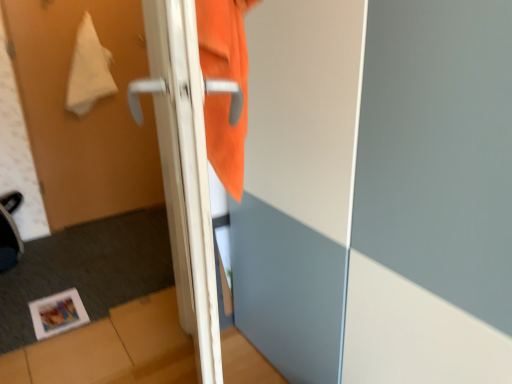
Question: Relative to matte paper photo frame at lower left, is white glossy door handle at left, the second screen door from the right, in front or behind?

Choices:
 (A) behind
 (B) front

Answer: (B)

Question: From the image's perspective, relative to matte paper photo frame at lower left, is white glossy door handle at left, the second screen door from the right, above or below?

Choices:
 (A) below
 (B) above

Answer: (B)

Question: Based on their relative distances, which object is nearer to the white fabric towel at upper left?

Choices:
 (A) white glossy door handle at center
 (B) orange fabric at center, arranged as the 1th screen door when viewed from the right
 (C) orange fabric sweatshirt at upper center
 (D) white matte towel at upper left, placed as the 3th screen door when sorted from right to left
 (E) white glossy door handle at left, the second screen door when ordered from left to right

Answer: (D)

Question: Which is farther from the white glossy door handle at left, the second screen door from the right?

Choices:
 (A) matte paper photo frame at lower left
 (B) white matte towel at upper left, which is the 1th screen door from left to right
 (C) white glossy door handle at center
 (D) orange fabric at center, the third screen door viewed from the left
 (E) orange fabric sweatshirt at upper center

Answer: (B)